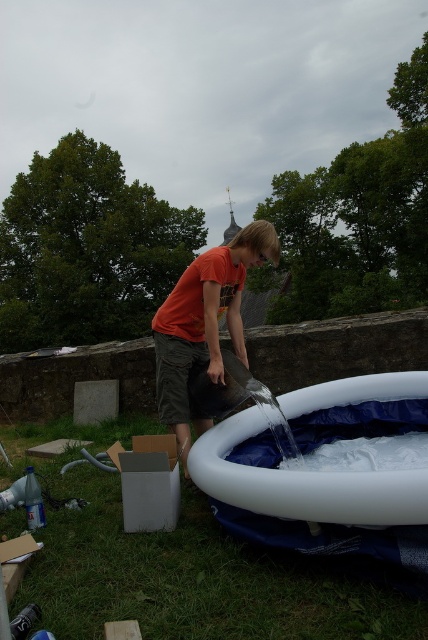
Can you confirm if white inflatable tub at lower center is bigger than orange t-shirt at center?

No, white inflatable tub at lower center is not bigger than orange t-shirt at center.

Does white inflatable tub at lower center appear on the right side of orange t-shirt at center?

Indeed, white inflatable tub at lower center is positioned on the right side of orange t-shirt at center.

Find the location of a particular element. Image resolution: width=428 pixels, height=640 pixels. white inflatable tub at lower center is located at coordinates (303, 483).